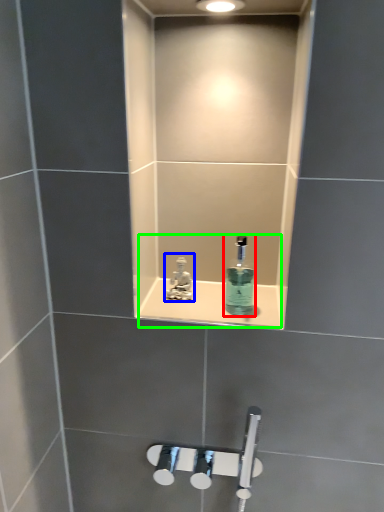
Question: Which object is positioned closest to mouthwash (highlighted by a red box)? Select from tap (highlighted by a blue box) and sink (highlighted by a green box).

Choices:
 (A) tap
 (B) sink

Answer: (B)